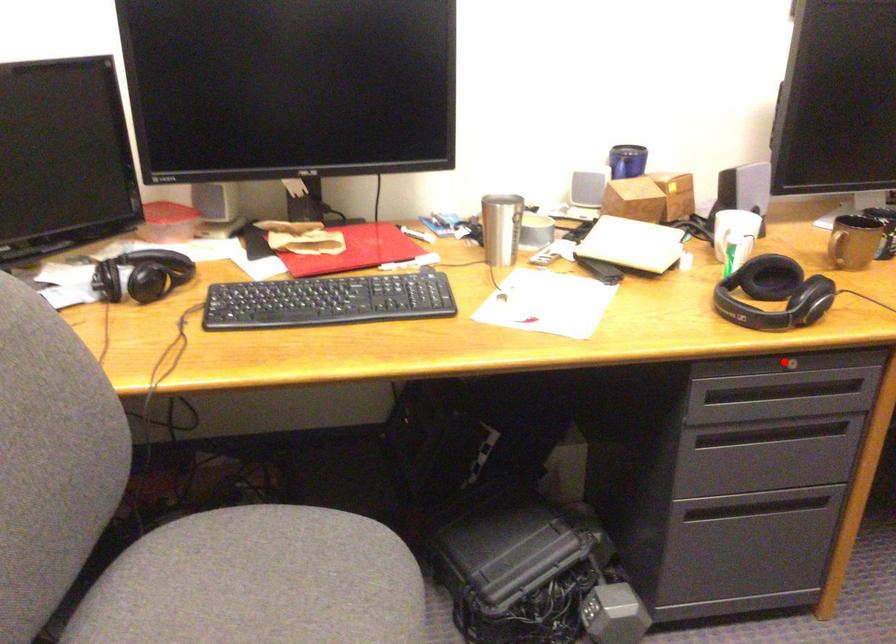
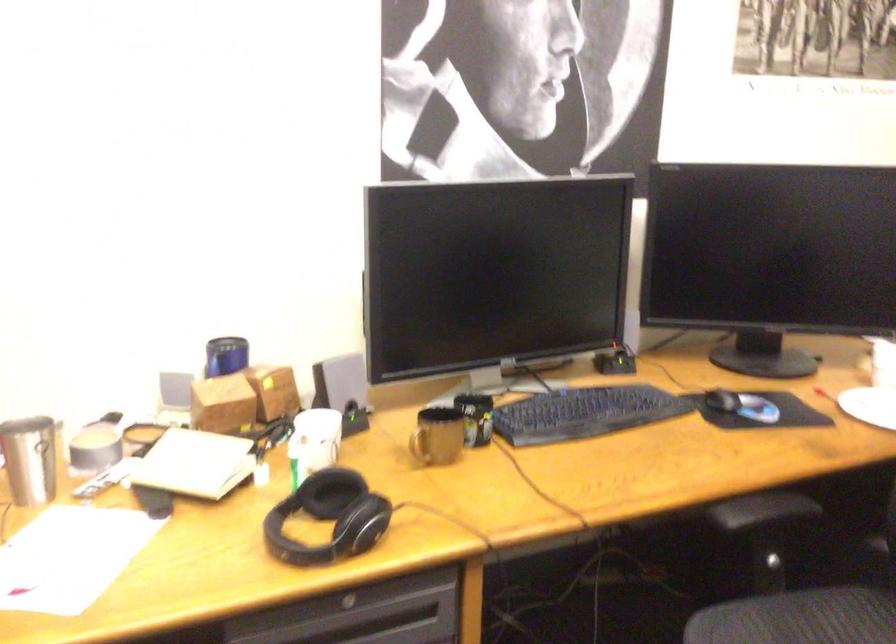
Question: I am providing you with two images of the same scene from different viewpoints. Image1 has a red point marked. In image2, the corresponding 3D location appears at what relative position? Reply with the corresponding letter.

Choices:
 (A) Closer
 (B) Farther

Answer: (A)